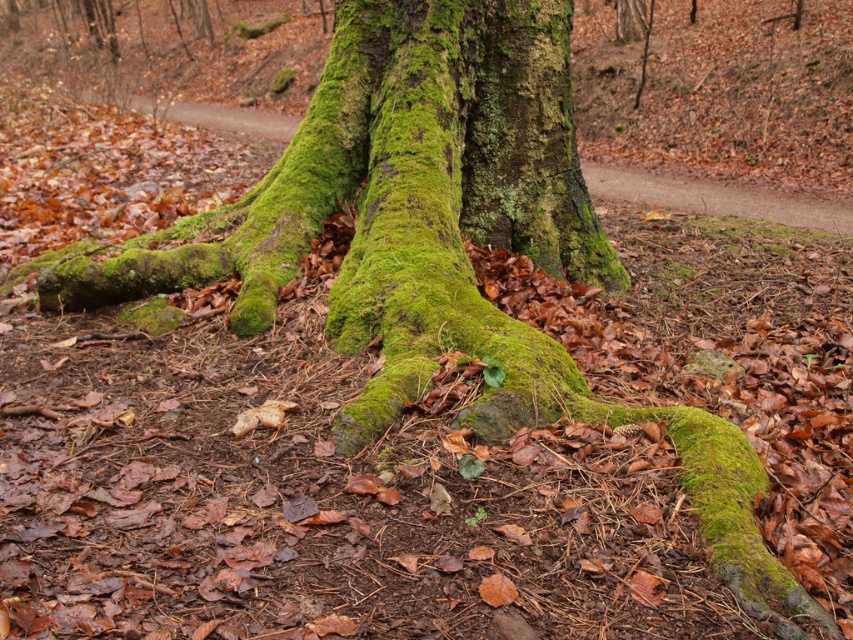
Based on the photo, you are a hiker who wants to place a small rock between the green mossy bark at center and the green mossy tree roots at center. Based on their positions, where would you place the rock?

The green mossy bark at center is positioned under the green mossy tree roots at center, so you should place the rock between them, ensuring it rests on the ground below the roots and above the bark.

You are standing in front of the tree trunk and looking at the two points marked in the image. Which point, point (569, 244) or point (606, 177), is nearer to you?

Point (569, 244) is closer to the camera than point (606, 177), so it is nearer to you.

You are a small insect trying to cross from the green mossy bark at center to the green mossy tree roots at center. Considering their widths, which path would be narrower for you to traverse?

The green mossy bark at center has a lesser width compared to green mossy tree roots at center, so the path over the green mossy bark at center would be narrower for you to traverse.